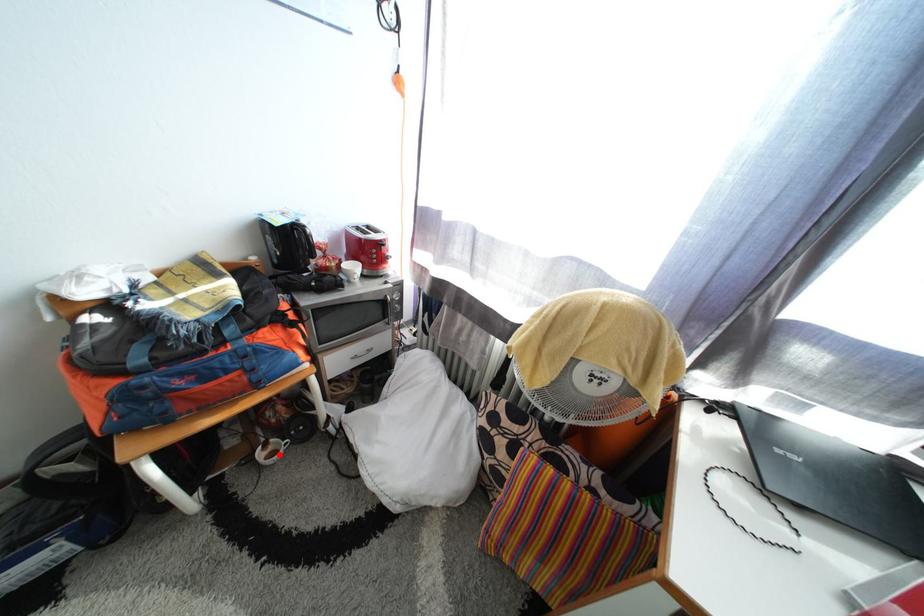
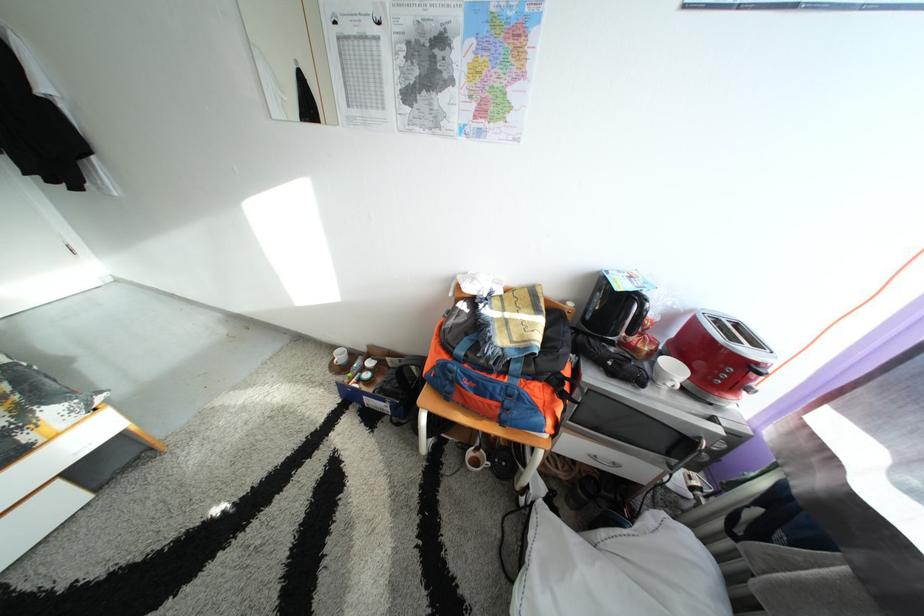
Question: I am providing you with two images of the same scene from different viewpoints. In image1, a red point is highlighted. Considering the same 3D point in image2, which of the following is correct?

Choices:
 (A) It is closer
 (B) It is farther

Answer: (B)